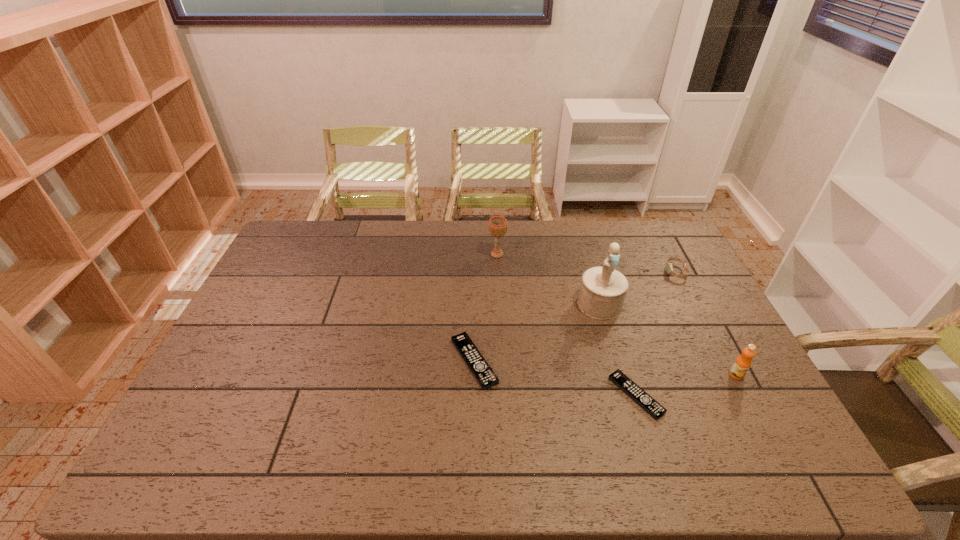
This screenshot has width=960, height=540. What are the coordinates of `object that is the nearest to the fifth shortest object` in the screenshot? It's located at (603, 289).

Select which object is the fifth closest to the right remote control. Please provide its 2D coordinates. Your answer should be formatted as a tuple, i.e. [(x, y)], where the tuple contains the x and y coordinates of a point satisfying the conditions above.

[(497, 225)]

Find the location of a particular element. Image resolution: width=960 pixels, height=540 pixels. free space in the image that satisfies the following two spatial constraints: 1. on the face of the fifth nearest object; 2. at the beak of the third farthest object is located at coordinates (692, 304).

This screenshot has height=540, width=960. In order to click on vacant point that satisfies the following two spatial constraints: 1. on the face of the fifth nearest object; 2. on the front side of the right remote control in this screenshot , I will do `click(739, 395)`.